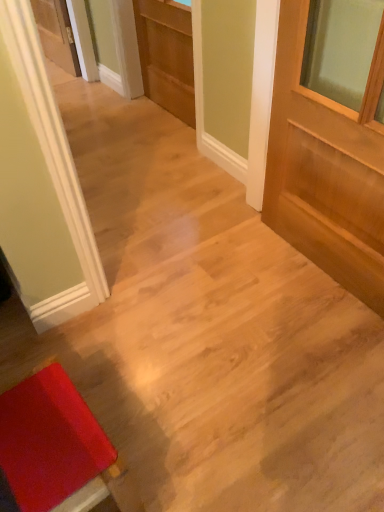
Question: Relative to rubberized red stool at lower left, is light brown wood door at center, acting as the 2th door starting from the front, in front or behind?

Choices:
 (A) behind
 (B) front

Answer: (A)

Question: Considering the relative positions of light brown wood door at center, which ranks as the 2th door in right-to-left order, and rubberized red stool at lower left in the image provided, is light brown wood door at center, which ranks as the 2th door in right-to-left order, to the left or to the right of rubberized red stool at lower left?

Choices:
 (A) right
 (B) left

Answer: (A)

Question: Which object is positioned closest to the rubberized red stool at lower left?

Choices:
 (A) light brown wood door at right, the first door when ordered from front to back
 (B) light brown wood door at center, acting as the 2th door starting from the front

Answer: (A)

Question: Estimate the real-world distances between objects in this image. Which object is farther from the light brown wood door at center, which ranks as the 2th door in right-to-left order?

Choices:
 (A) light brown wood door at right, the first door when ordered from front to back
 (B) rubberized red stool at lower left

Answer: (B)